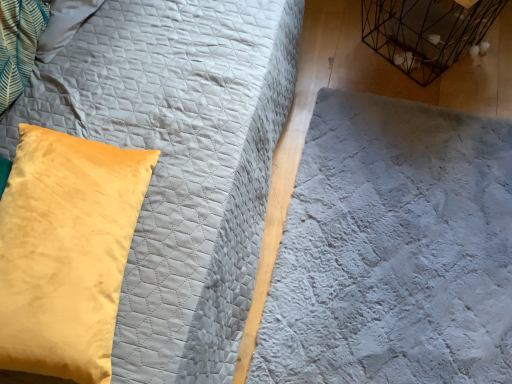
Where is `free spot in front of black wire birdcage at upper right`? free spot in front of black wire birdcage at upper right is located at coordinates (450, 101).